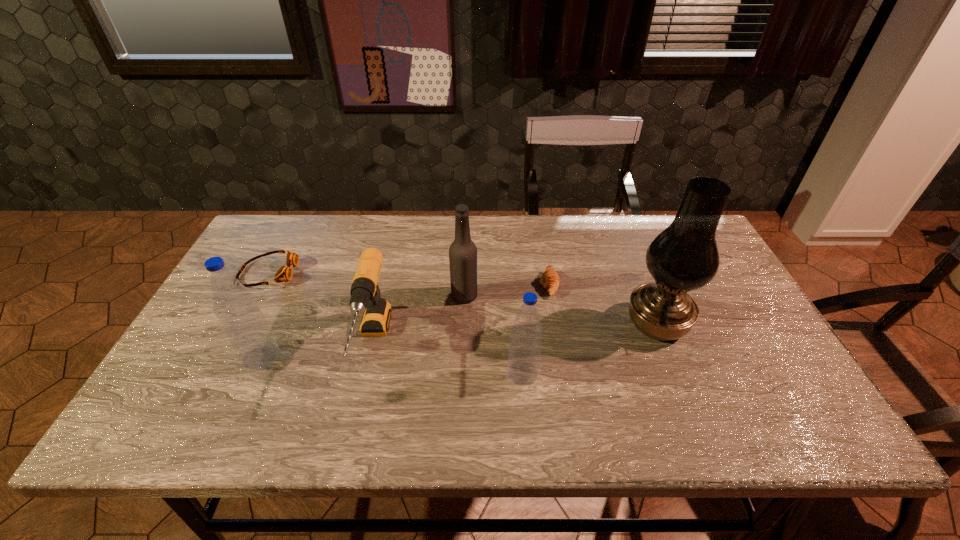
The width and height of the screenshot is (960, 540). I want to click on the left water bottle, so click(245, 326).

Identify the location of the right water bottle. (524, 353).

The height and width of the screenshot is (540, 960). Find the location of `the fifth object from left to right`. the fifth object from left to right is located at coordinates (524, 353).

Where is `beer bottle`? This screenshot has width=960, height=540. beer bottle is located at coordinates (463, 252).

Where is `the tallest object`? This screenshot has height=540, width=960. the tallest object is located at coordinates 683,257.

Find the location of a particular element. This screenshot has width=960, height=540. oil lamp is located at coordinates (683, 257).

Find the location of a particular element. This screenshot has width=960, height=540. goggles is located at coordinates (284, 273).

At what (x,y) coordinates should I click in order to perform the action: click on the second object from right to left. Please return your answer as a coordinate pair (x, y). This screenshot has width=960, height=540. Looking at the image, I should click on (550, 280).

This screenshot has width=960, height=540. I want to click on the third shortest object, so click(365, 294).

The image size is (960, 540). Find the location of `drill`. drill is located at coordinates (365, 294).